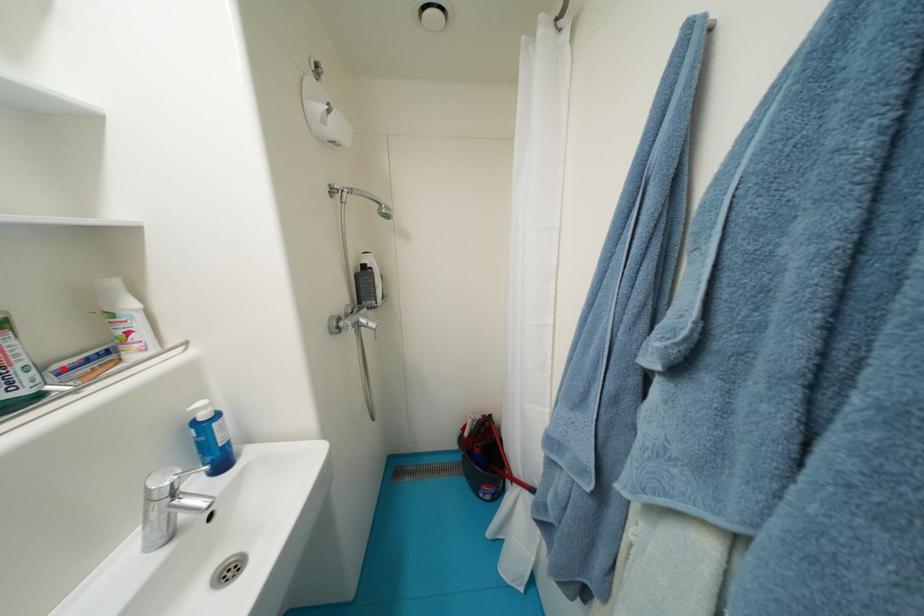
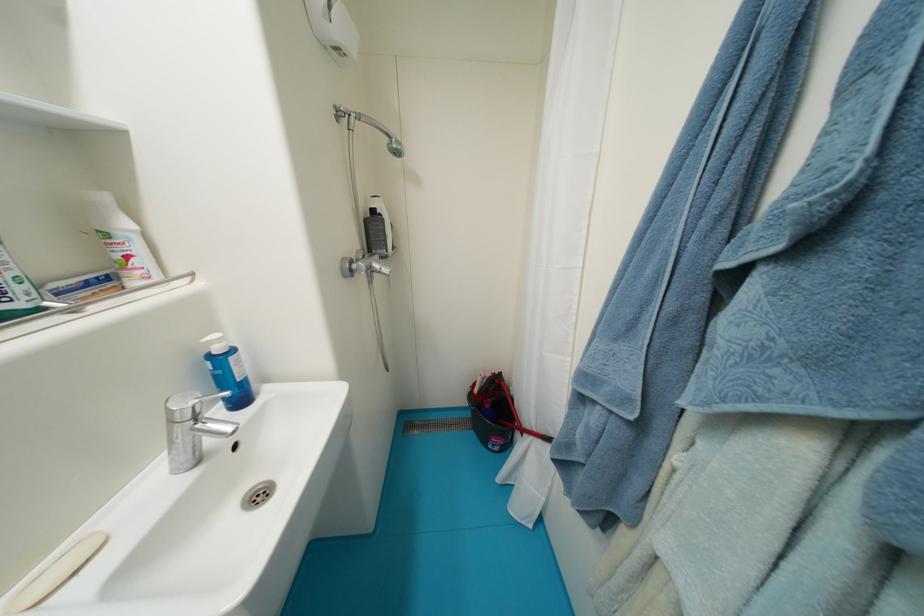
Find the pixel in the second image that matches the highlighted location in the first image.

(61, 286)